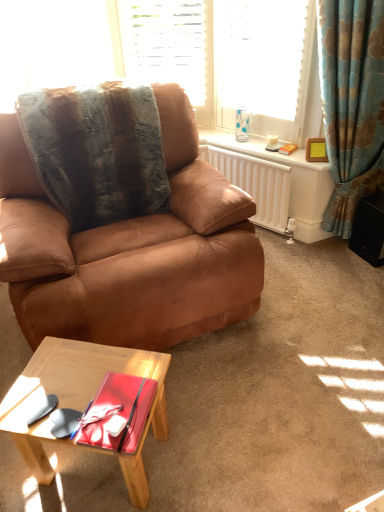
Where is `free space in front of translucent glass coffee cup at upper right`? This screenshot has height=512, width=384. free space in front of translucent glass coffee cup at upper right is located at coordinates (289, 155).